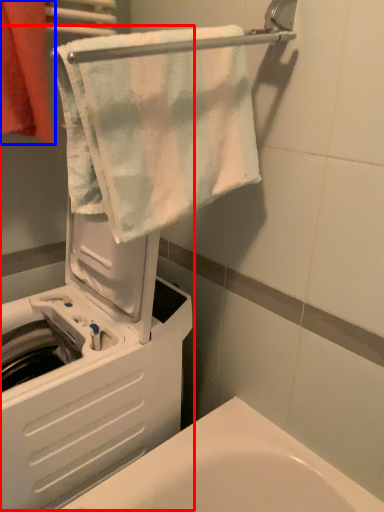
Question: Among these objects, which one is nearest to the camera, machine (highlighted by a red box) or towel (highlighted by a blue box)?

Choices:
 (A) machine
 (B) towel

Answer: (A)